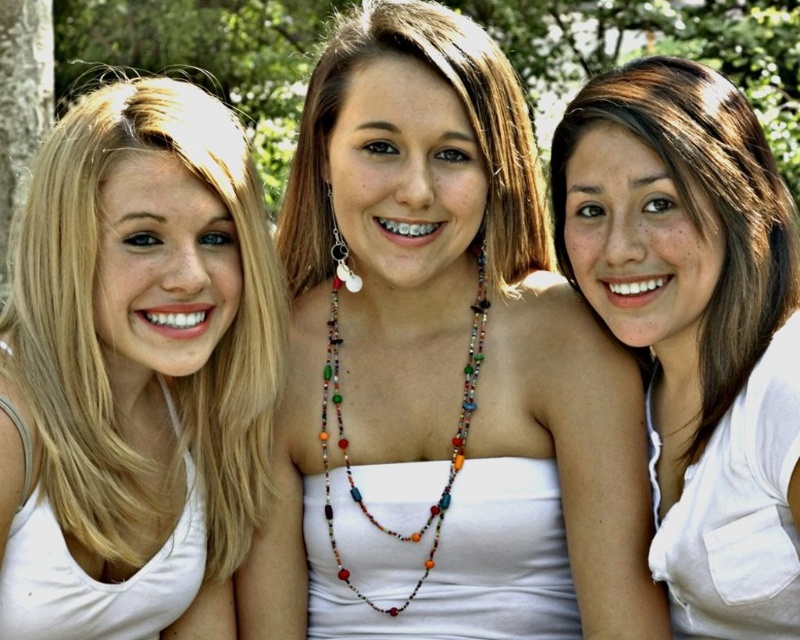
Question: Considering the relative positions of blonde hair at left and matte multicolored necklace at center in the image provided, where is blonde hair at left located with respect to matte multicolored necklace at center?

Choices:
 (A) right
 (B) left

Answer: (B)

Question: Which of the following is the farthest from the observer?

Choices:
 (A) (96, 8)
 (B) (328, 150)
 (C) (430, 516)
 (D) (314, 136)

Answer: (A)

Question: Estimate the real-world distances between objects in this image. Which object is closer to the white matte shirt at right?

Choices:
 (A) green leafy tree at upper center
 (B) matte multicolored necklace at center
 (C) multicolored beaded necklace at center
 (D) blonde hair at left

Answer: (B)

Question: Does white matte tank top at center have a greater width compared to multicolored beaded necklace at center?

Choices:
 (A) yes
 (B) no

Answer: (A)

Question: Which object is farther from the camera taking this photo?

Choices:
 (A) blonde hair at left
 (B) matte multicolored necklace at center

Answer: (B)

Question: Considering the relative positions of blonde hair at left and multicolored beaded necklace at center in the image provided, where is blonde hair at left located with respect to multicolored beaded necklace at center?

Choices:
 (A) right
 (B) left

Answer: (B)